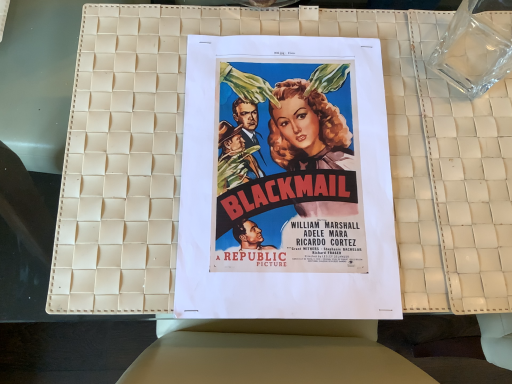
This screenshot has width=512, height=384. Find the location of `empty space that is ontop of matte paper poster at center`. empty space that is ontop of matte paper poster at center is located at coordinates (286, 159).